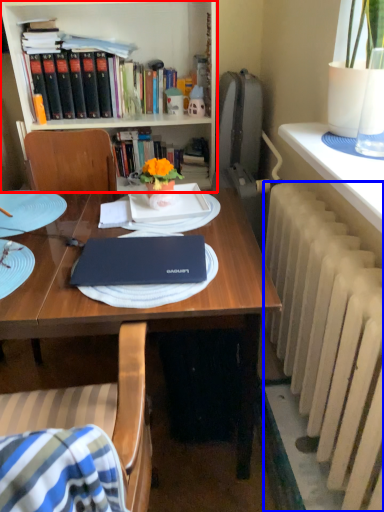
Question: Among these objects, which one is nearest to the camera, bookcase (highlighted by a red box) or radiator (highlighted by a blue box)?

Choices:
 (A) bookcase
 (B) radiator

Answer: (B)